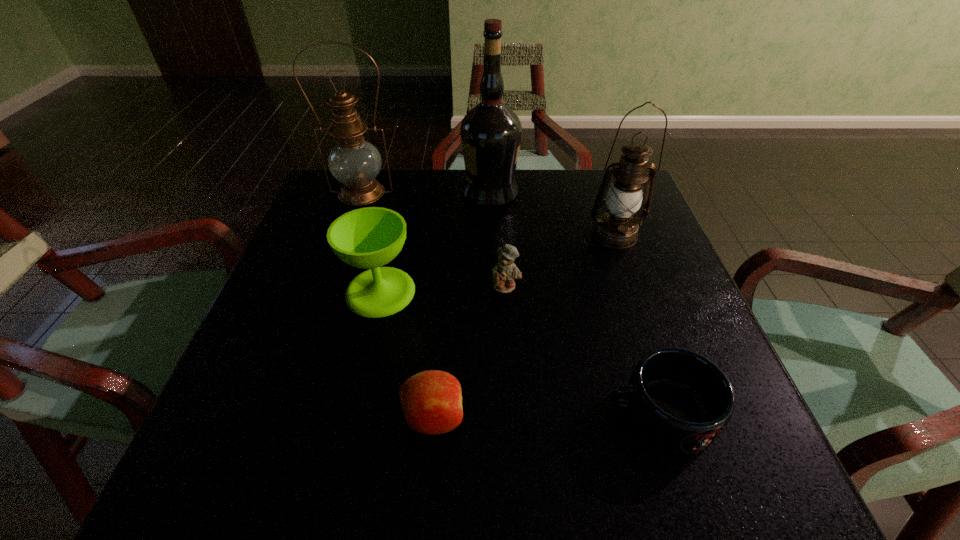
Identify the location of free location at the near edge of the desktop. (432, 464).

Find the location of a particular element. The height and width of the screenshot is (540, 960). free space at the left edge is located at coordinates (308, 301).

In the image, there is a desktop. What are the coordinates of `vacant space at the near right corner` in the screenshot? It's located at tap(686, 476).

This screenshot has width=960, height=540. Find the location of `blank region between the mug and the left oil lamp`. blank region between the mug and the left oil lamp is located at coordinates (511, 303).

Image resolution: width=960 pixels, height=540 pixels. What are the coordinates of `vacant region between the teddy bear and the right oil lamp` in the screenshot? It's located at (561, 260).

Locate an element on the screen. unoccupied position between the wineglass and the liquor is located at coordinates (435, 241).

Image resolution: width=960 pixels, height=540 pixels. I want to click on vacant space in between the liquor and the teddy bear, so click(x=498, y=239).

You are a GUI agent. You are given a task and a screenshot of the screen. Output one action in this format:
    pyautogui.click(x=<x>, y=<y>)
    Task: Click on the vacant area that lies between the fifth nearest object and the liquor
    Image resolution: width=960 pixels, height=540 pixels.
    Given the screenshot: What is the action you would take?
    pyautogui.click(x=552, y=213)

Locate an element on the screen. The height and width of the screenshot is (540, 960). free space between the liquor and the wineglass is located at coordinates [x=435, y=241].

I want to click on free space between the teddy bear and the left oil lamp, so click(434, 240).